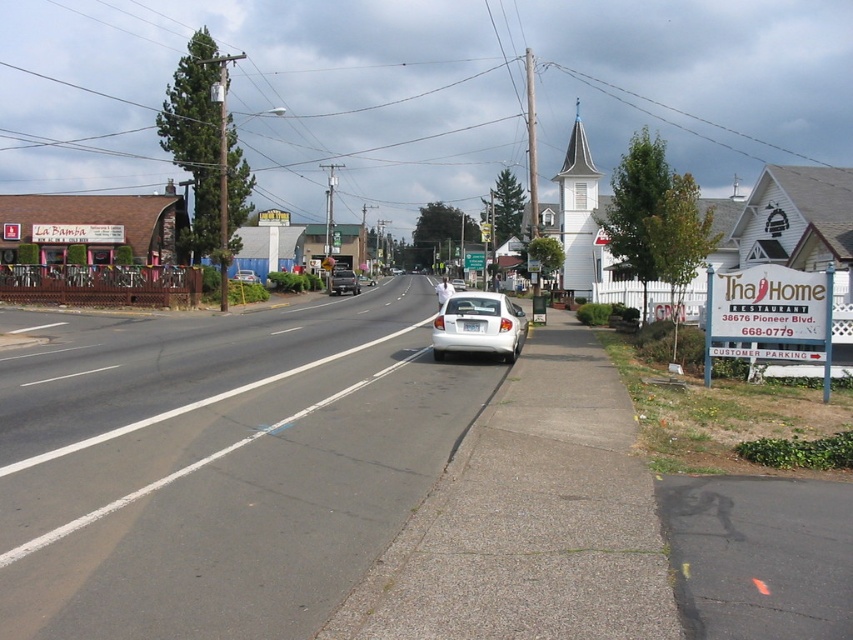
Does white matte car at center come behind white matte sedan at center?

No, it is not.

Between white matte car at center and white matte sedan at center, which one appears on the right side from the viewer's perspective?

white matte sedan at center

Who is more forward, (463, 339) or (457, 282)?

Point (463, 339) is in front.

This screenshot has height=640, width=853. I want to click on white matte car at center, so click(x=479, y=324).

Who is higher up, white plastic sign at right or white matte car at center?

white plastic sign at right is above.

Find the location of a particular element. white plastic sign at right is located at coordinates (769, 316).

Locate an element on the screen. The width and height of the screenshot is (853, 640). white plastic sign at right is located at coordinates (769, 316).

Can you confirm if white plastic sign at right is shorter than white wood spire at upper right?

Indeed, white plastic sign at right has a lesser height compared to white wood spire at upper right.

Does white plastic sign at right appear over white wood spire at upper right?

No, white plastic sign at right is not above white wood spire at upper right.

Which is in front, point (723, 285) or point (567, 152)?

Point (723, 285)

Image resolution: width=853 pixels, height=640 pixels. Identify the location of white plastic sign at right. (769, 316).